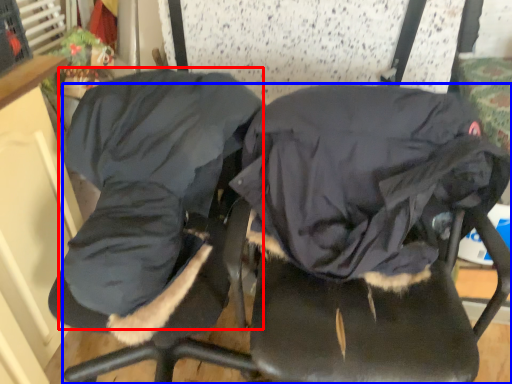
Question: Which point is further to the camera, clothing (highlighted by a red box) or chair (highlighted by a blue box)?

Choices:
 (A) clothing
 (B) chair

Answer: (A)